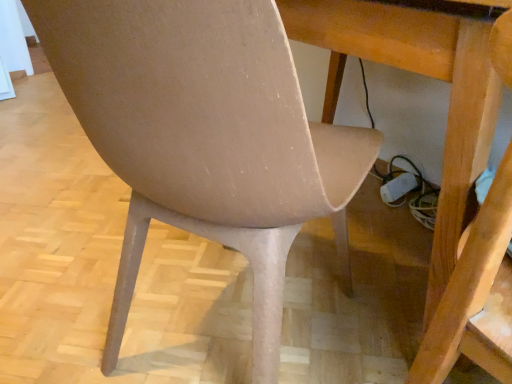
Question: From a real-world perspective, is matte beige chair at center beneath matte beige swivel chair at lower left?

Choices:
 (A) no
 (B) yes

Answer: (B)

Question: Is matte beige chair at center at the left side of matte beige swivel chair at lower left?

Choices:
 (A) no
 (B) yes

Answer: (B)

Question: Considering the relative positions of matte beige chair at center and matte beige swivel chair at lower left in the image provided, is matte beige chair at center to the right of matte beige swivel chair at lower left from the viewer's perspective?

Choices:
 (A) no
 (B) yes

Answer: (A)

Question: Does matte beige chair at center have a smaller size compared to matte beige swivel chair at lower left?

Choices:
 (A) no
 (B) yes

Answer: (A)

Question: From the image's perspective, is matte beige chair at center on matte beige swivel chair at lower left?

Choices:
 (A) yes
 (B) no

Answer: (A)

Question: Can you see matte beige chair at center touching matte beige swivel chair at lower left?

Choices:
 (A) no
 (B) yes

Answer: (A)

Question: Considering the relative positions of wooden table at center and matte beige swivel chair at lower left in the image provided, is wooden table at center to the right of matte beige swivel chair at lower left from the viewer's perspective?

Choices:
 (A) no
 (B) yes

Answer: (A)

Question: Is wooden table at center oriented away from matte beige swivel chair at lower left?

Choices:
 (A) yes
 (B) no

Answer: (B)

Question: Does wooden table at center appear on the left side of matte beige swivel chair at lower left?

Choices:
 (A) yes
 (B) no

Answer: (A)

Question: From the image's perspective, is wooden table at center beneath matte beige swivel chair at lower left?

Choices:
 (A) yes
 (B) no

Answer: (B)

Question: Can matte beige swivel chair at lower left be found inside wooden table at center?

Choices:
 (A) no
 (B) yes

Answer: (B)

Question: Is wooden table at center oriented towards matte beige swivel chair at lower left?

Choices:
 (A) yes
 (B) no

Answer: (A)

Question: Is wooden table at center oriented towards matte beige chair at center?

Choices:
 (A) no
 (B) yes

Answer: (B)